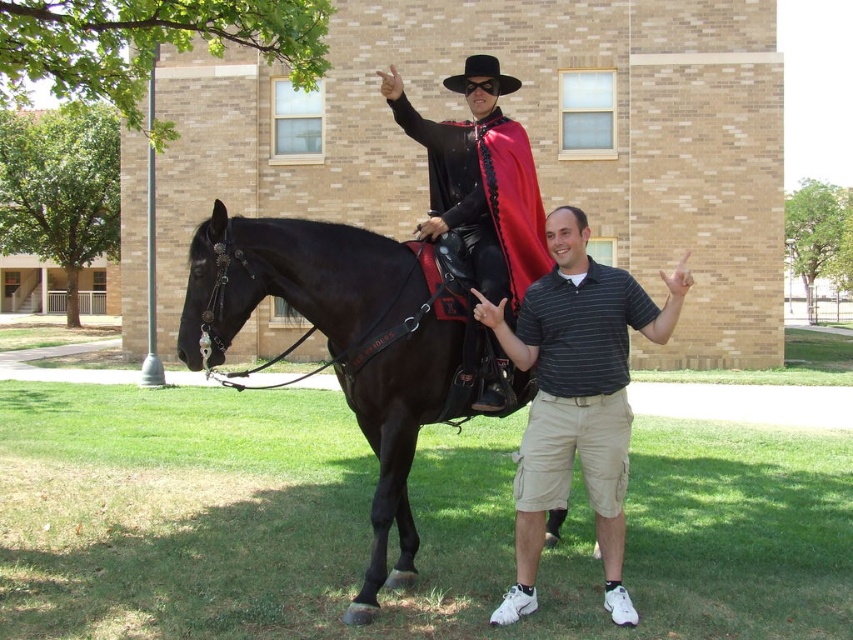
Question: Which is farther from the khaki cargo shorts at lower right?

Choices:
 (A) shiny black cape at center
 (B) shiny black horse at center

Answer: (B)

Question: Which object is positioned farthest from the khaki cargo shorts at lower right?

Choices:
 (A) shiny black cape at center
 (B) shiny black horse at center

Answer: (B)

Question: Does shiny black horse at center appear over khaki cargo shorts at lower right?

Choices:
 (A) yes
 (B) no

Answer: (A)

Question: Which of the following is the closest to the observer?

Choices:
 (A) shiny black horse at center
 (B) shiny black cape at center
 (C) khaki cargo shorts at lower right

Answer: (C)

Question: Can you confirm if shiny black horse at center is bigger than khaki cargo shorts at lower right?

Choices:
 (A) no
 (B) yes

Answer: (B)

Question: From the image, what is the correct spatial relationship of khaki cargo shorts at lower right in relation to shiny black cape at center?

Choices:
 (A) right
 (B) left

Answer: (A)